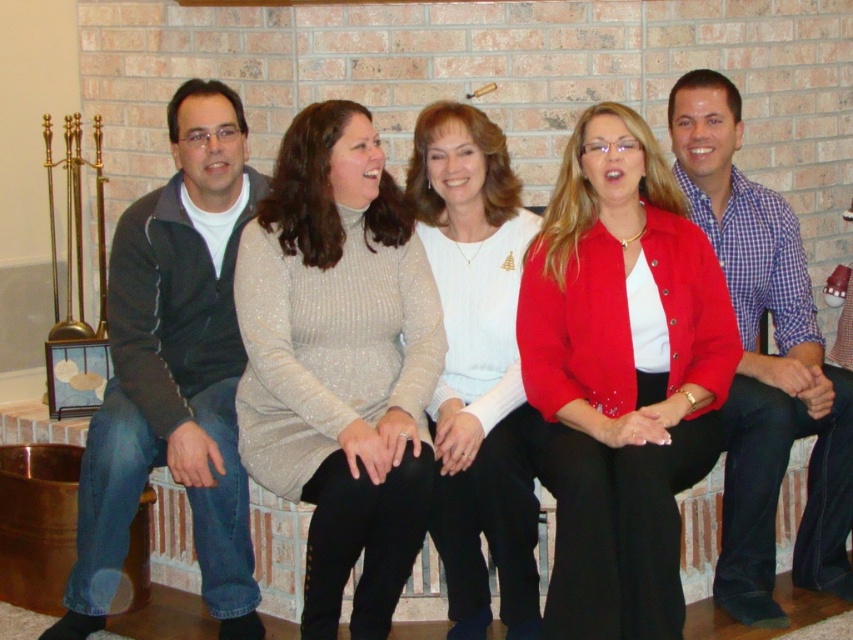
Question: Is black matte jacket at left below white glittery sweater at center?

Choices:
 (A) yes
 (B) no

Answer: (B)

Question: Can you confirm if black matte jacket at left is bigger than white glittery sweater at center?

Choices:
 (A) no
 (B) yes

Answer: (B)

Question: Among these objects, which one is farthest from the camera?

Choices:
 (A) sparkly beige sweater at center
 (B) white glittery sweater at center
 (C) black matte jacket at left

Answer: (C)

Question: Is matte red jacket at center smaller than white glittery sweater at center?

Choices:
 (A) no
 (B) yes

Answer: (A)

Question: Which object is closer to the camera taking this photo?

Choices:
 (A) white glittery sweater at center
 (B) sparkly beige sweater at center
 (C) matte red jacket at center
 (D) black matte jacket at left

Answer: (C)

Question: Which point is closer to the camera?

Choices:
 (A) sparkly beige sweater at center
 (B) matte red jacket at center

Answer: (B)